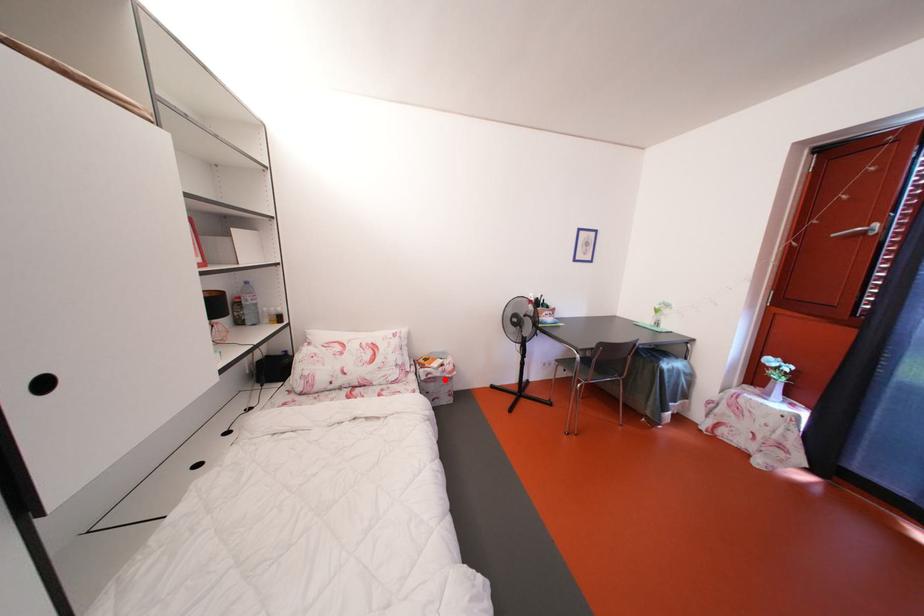
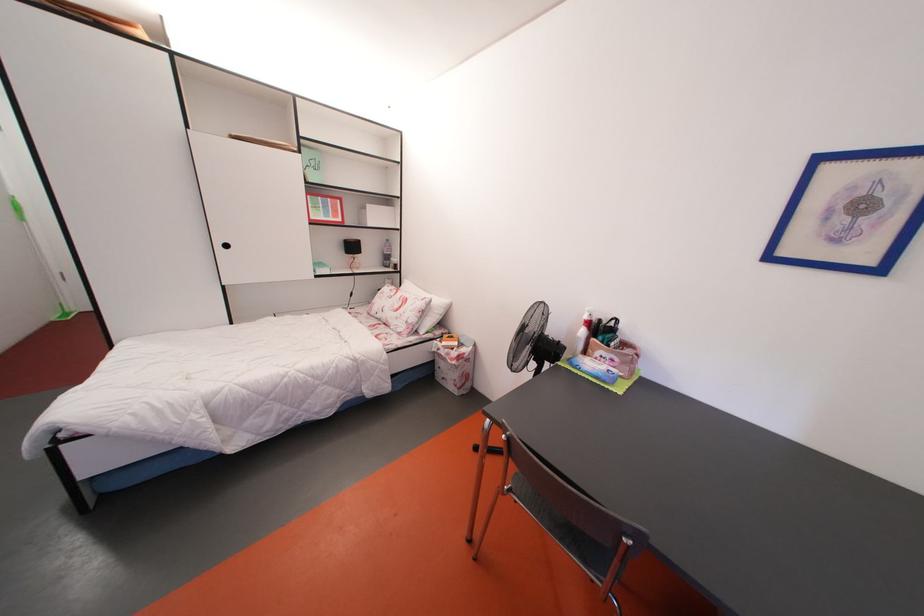
Where in the second image is the point corresponding to the highlighted location from the first image?

(450, 360)